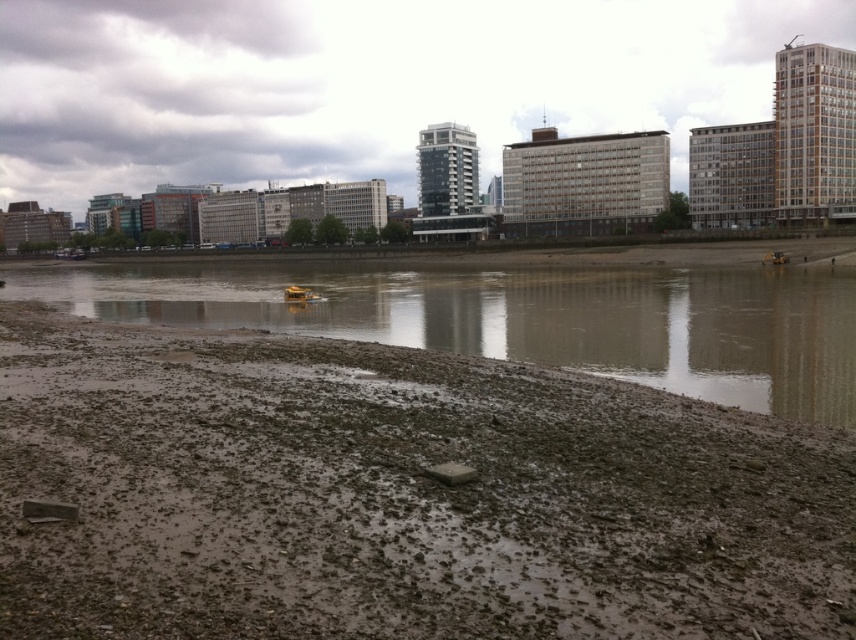
Is point (635, 412) less distant than point (678, 358)?

Yes.

Between point (204, 371) and point (474, 304), which one is positioned behind?

The point (474, 304) is behind.

Which is in front, point (764, 472) or point (703, 288)?

Point (764, 472) is in front.

At what (x,y) coordinates should I click in order to perform the action: click on muddy wet ground at lower left. Please return your answer as a coordinate pair (x, y). The width and height of the screenshot is (856, 640). Looking at the image, I should click on (397, 497).